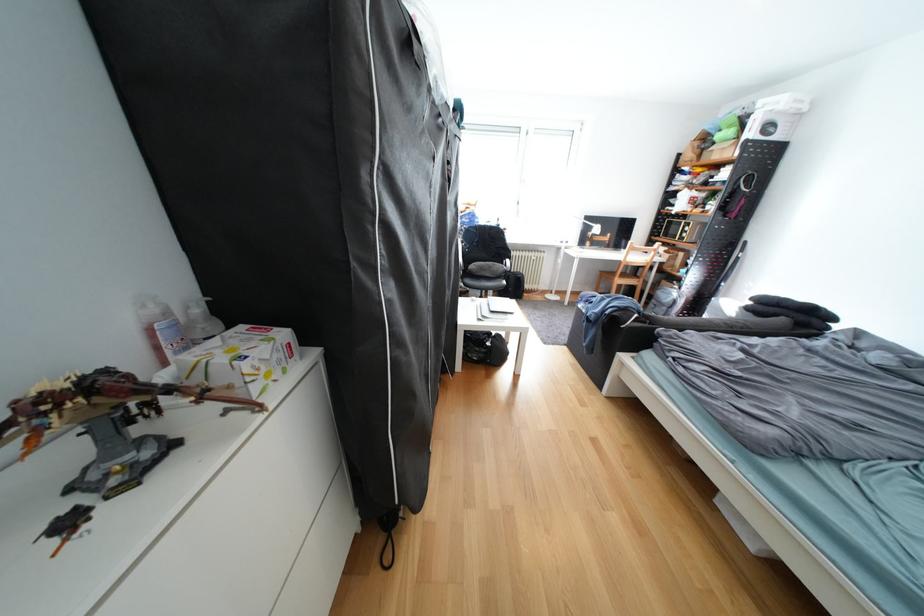
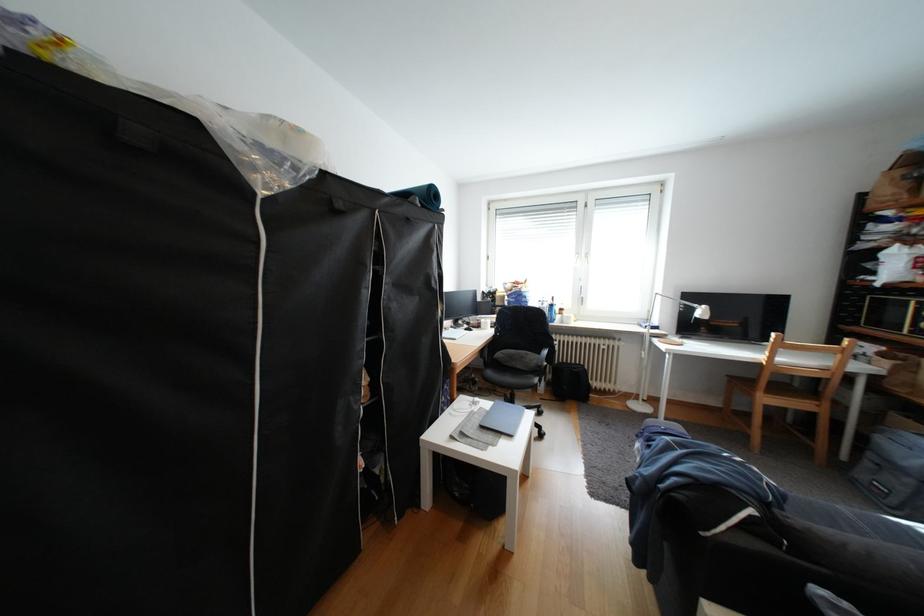
In the second image, find the point that corresponds to point (615, 300) in the first image.

(682, 448)